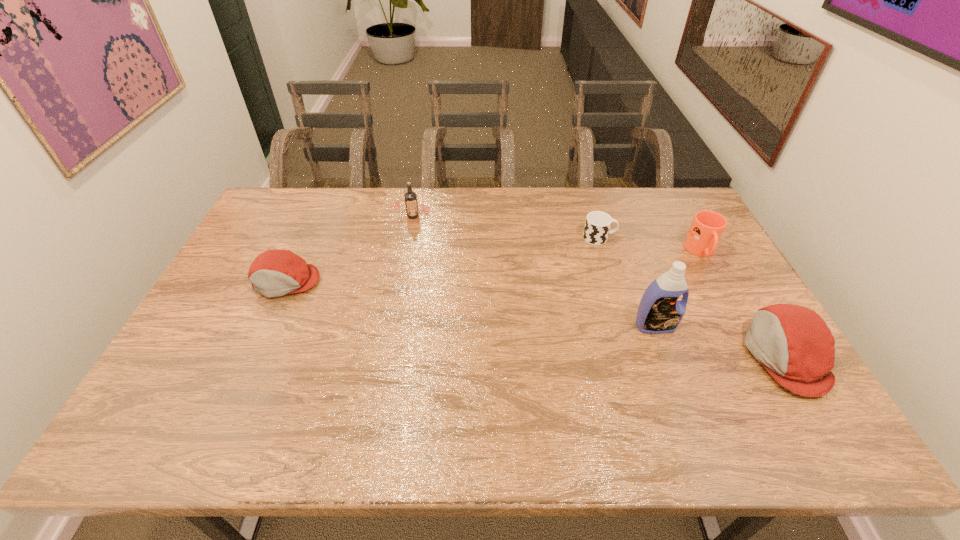
Identify the location of cap present at the right edge. (796, 346).

At what (x,y) coordinates should I click in order to perform the action: click on mug that is at the right edge. Please return your answer as a coordinate pair (x, y). The width and height of the screenshot is (960, 540). Looking at the image, I should click on (707, 227).

Locate an element on the screen. Image resolution: width=960 pixels, height=540 pixels. object situated at the near right corner is located at coordinates (796, 346).

Locate an element on the screen. vacant region at the far edge of the desktop is located at coordinates (536, 205).

Locate an element on the screen. free spot at the near edge of the desktop is located at coordinates (x=684, y=397).

Identify the location of vacant space at the left edge of the desktop. This screenshot has width=960, height=540. (252, 322).

The height and width of the screenshot is (540, 960). What are the coordinates of `vacant region at the right edge of the desktop` in the screenshot? It's located at (715, 293).

Identify the location of vacant area at the far right corner of the desktop. (662, 213).

I want to click on free area in between the left cap and the mug, so click(x=493, y=267).

This screenshot has width=960, height=540. Identify the location of free space between the cup and the root beer. (506, 227).